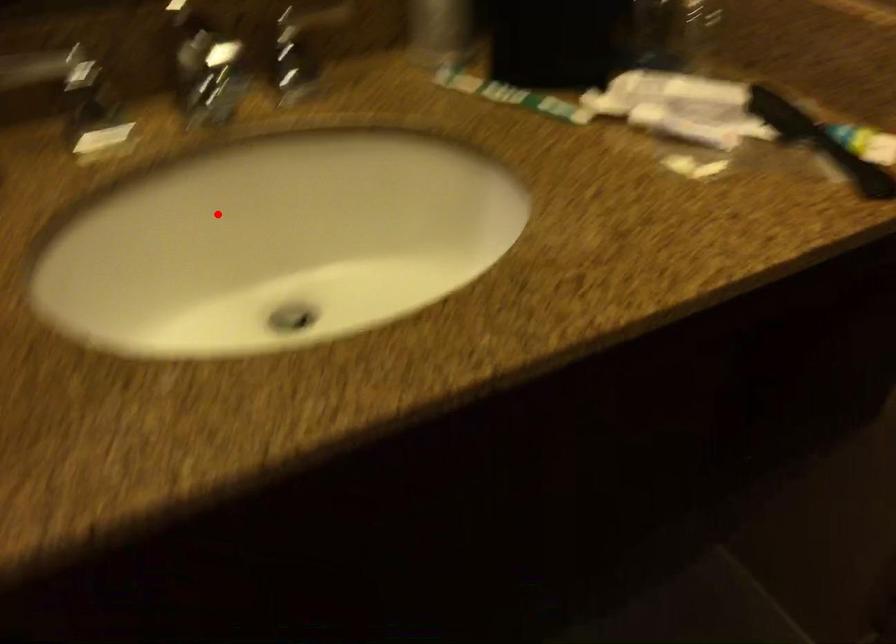
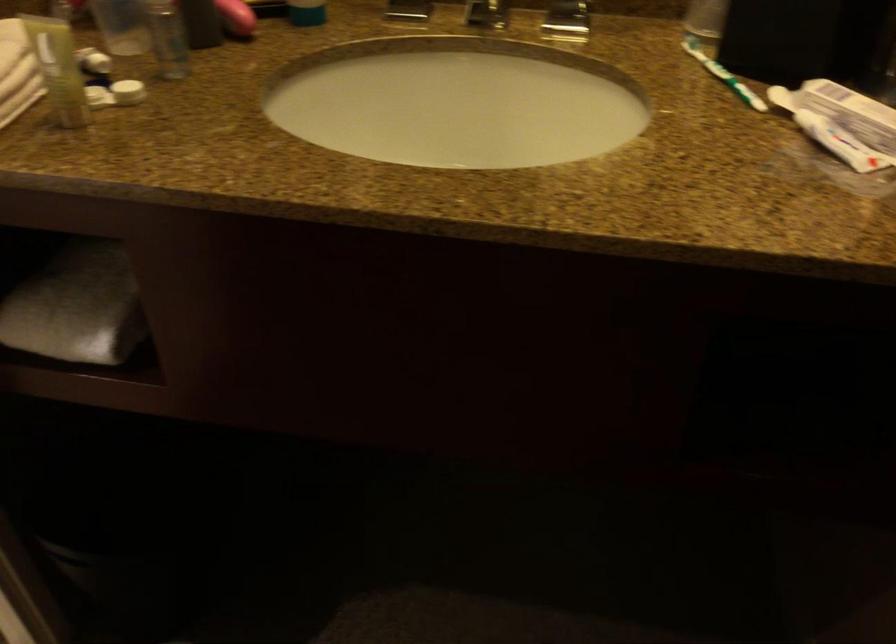
Find the pixel in the second image that matches the highlighted location in the first image.

(457, 102)